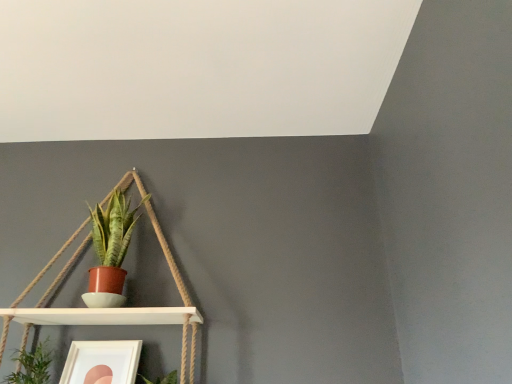
Question: Is white matte picture frame at lower left completely or partially outside of green leafy plant at lower left, which is the 2th houseplant in right-to-left order?

Choices:
 (A) yes
 (B) no

Answer: (A)

Question: Is white matte picture frame at lower left closer to the viewer compared to green leafy plant at lower left, the 1th houseplant from the bottom?

Choices:
 (A) no
 (B) yes

Answer: (A)

Question: Considering the relative sizes of white matte picture frame at lower left and green leafy plant at lower left, the 1th houseplant from the bottom, in the image provided, is white matte picture frame at lower left bigger than green leafy plant at lower left, the 1th houseplant from the bottom,?

Choices:
 (A) no
 (B) yes

Answer: (A)

Question: Does white matte picture frame at lower left have a smaller size compared to green leafy plant at lower left, which is the second houseplant from top to bottom?

Choices:
 (A) no
 (B) yes

Answer: (B)

Question: Is white matte picture frame at lower left in contact with green leafy plant at lower left, the 1th houseplant from the bottom?

Choices:
 (A) yes
 (B) no

Answer: (B)

Question: In terms of width, does matte terracotta pot at center-left, positioned as the first houseplant in top-to-bottom order, look wider or thinner when compared to green leafy plant at lower left, which is the 2th houseplant in right-to-left order?

Choices:
 (A) wide
 (B) thin

Answer: (B)

Question: Choose the correct answer: Is matte terracotta pot at center-left, positioned as the first houseplant in top-to-bottom order, inside green leafy plant at lower left, the 1th houseplant from the bottom, or outside it?

Choices:
 (A) inside
 (B) outside

Answer: (B)

Question: From the image's perspective, is matte terracotta pot at center-left, the second houseplant in the bottom-to-top sequence, above or below green leafy plant at lower left, which is the 2th houseplant in right-to-left order?

Choices:
 (A) above
 (B) below

Answer: (A)

Question: From a real-world perspective, is matte terracotta pot at center-left, the second houseplant in the bottom-to-top sequence, above or below green leafy plant at lower left, which is the second houseplant from top to bottom?

Choices:
 (A) below
 (B) above

Answer: (B)

Question: From a real-world perspective, relative to green leafy plant at lower left, which is the second houseplant from top to bottom, is white matte picture frame at lower left vertically above or below?

Choices:
 (A) above
 (B) below

Answer: (B)

Question: Considering their positions, is white matte picture frame at lower left located in front of or behind green leafy plant at lower left, the first houseplant in the left-to-right sequence?

Choices:
 (A) front
 (B) behind

Answer: (B)

Question: In terms of height, does white matte picture frame at lower left look taller or shorter compared to green leafy plant at lower left, which is the second houseplant from top to bottom?

Choices:
 (A) short
 (B) tall

Answer: (A)

Question: Which is correct: white matte picture frame at lower left is inside green leafy plant at lower left, which is the 2th houseplant in right-to-left order, or outside of it?

Choices:
 (A) outside
 (B) inside

Answer: (A)

Question: Looking at the image, does white matte picture frame at lower left seem bigger or smaller compared to matte terracotta pot at center-left, positioned as the first houseplant in top-to-bottom order?

Choices:
 (A) big
 (B) small

Answer: (B)

Question: Considering the positions of white matte picture frame at lower left and matte terracotta pot at center-left, the second houseplant in the bottom-to-top sequence, in the image, is white matte picture frame at lower left taller or shorter than matte terracotta pot at center-left, the second houseplant in the bottom-to-top sequence,?

Choices:
 (A) short
 (B) tall

Answer: (A)